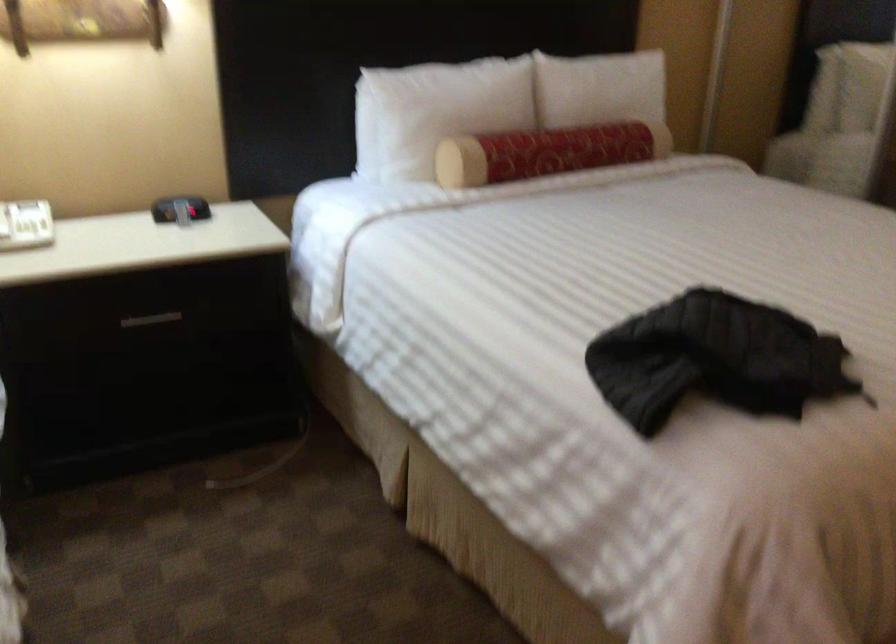
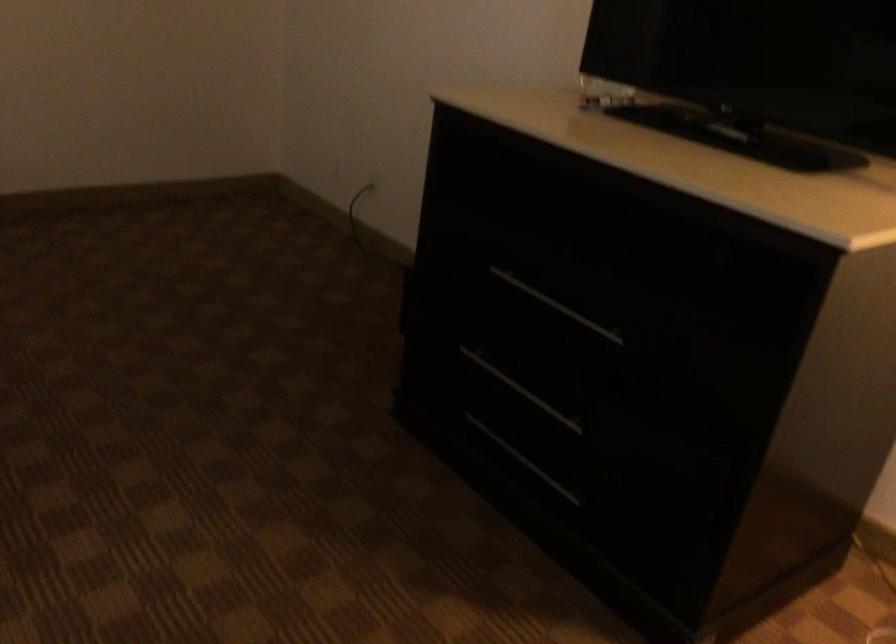
First-person continuous shooting, in which direction is the camera rotating?

The rotation direction of the camera is right-down.